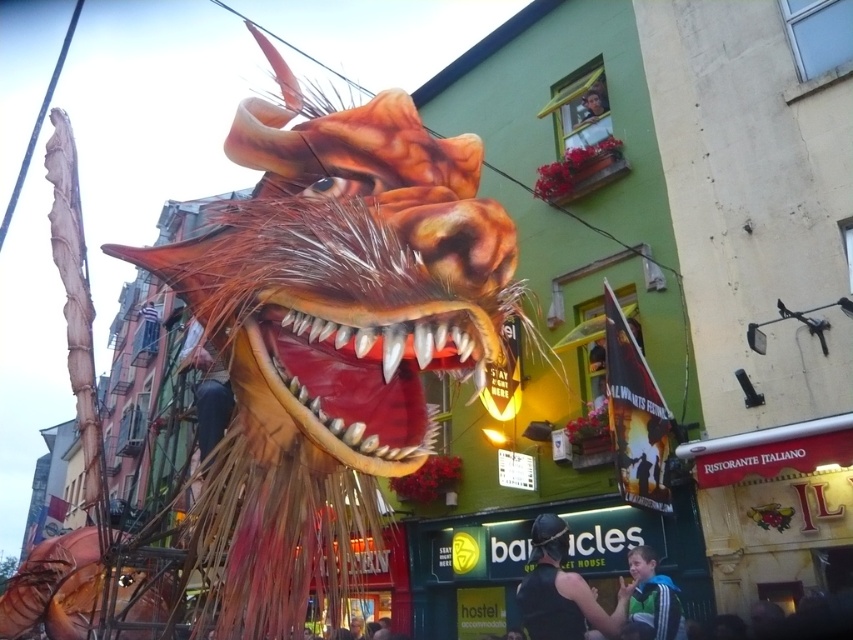
Question: Can you confirm if black leather jacket at center is positioned to the left of green fabric jacket at lower right?

Choices:
 (A) no
 (B) yes

Answer: (B)

Question: Among these objects, which one is nearest to the camera?

Choices:
 (A) green fabric jacket at lower right
 (B) black leather jacket at center

Answer: (B)

Question: Does black leather jacket at center have a greater width compared to green fabric jacket at lower right?

Choices:
 (A) yes
 (B) no

Answer: (A)

Question: Which point is farther to the camera?

Choices:
 (A) (317, 444)
 (B) (525, 609)

Answer: (B)

Question: Is shiny metallic dragon head at center smaller than green fabric jacket at lower right?

Choices:
 (A) yes
 (B) no

Answer: (B)

Question: Which is nearer to the green fabric jacket at lower right?

Choices:
 (A) shiny metallic dragon head at center
 (B) black leather jacket at center

Answer: (B)